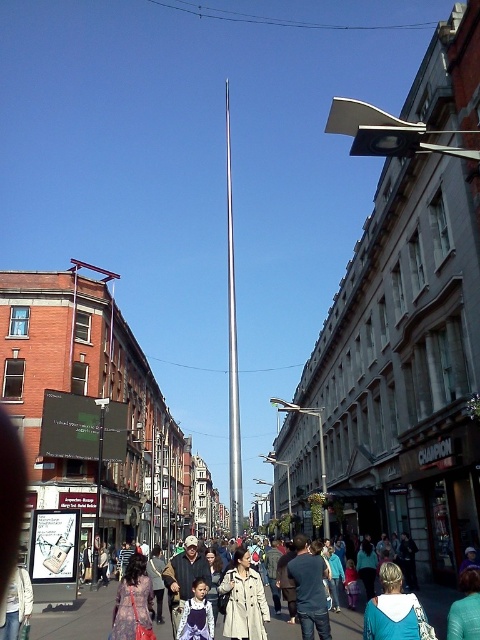
Question: Is silver metallic flag pole at center closer to camera compared to teal hoodie at lower right?

Choices:
 (A) no
 (B) yes

Answer: (A)

Question: Can you confirm if silver metallic flag pole at center is positioned to the left of teal hoodie at lower right?

Choices:
 (A) no
 (B) yes

Answer: (B)

Question: Does silver metallic flag pole at center have a larger size compared to teal hoodie at lower right?

Choices:
 (A) no
 (B) yes

Answer: (B)

Question: Which object appears closest to the camera in this image?

Choices:
 (A) teal hoodie at lower right
 (B) silver metallic flag pole at center

Answer: (A)